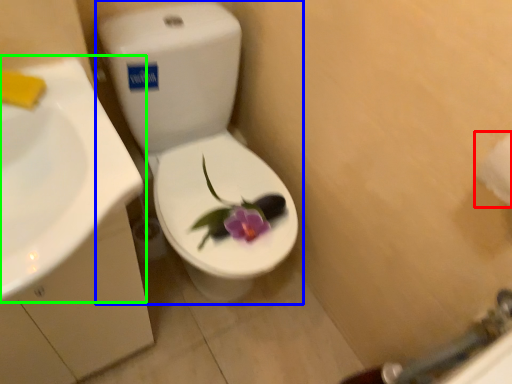
Question: Which object is the closest to the toilet paper (highlighted by a red box)? Choose among these: toilet (highlighted by a blue box) or sink (highlighted by a green box).

Choices:
 (A) toilet
 (B) sink

Answer: (B)